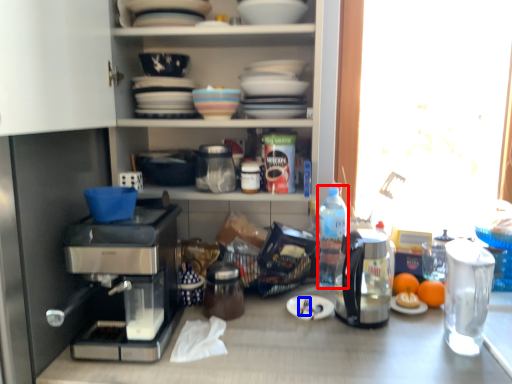
Question: Which point is further to the camera, bottle (highlighted by a red box) or silverware (highlighted by a blue box)?

Choices:
 (A) bottle
 (B) silverware

Answer: (A)